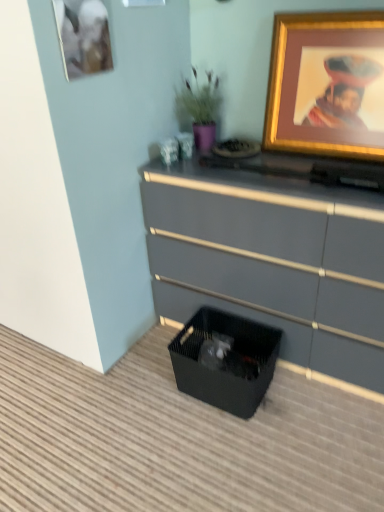
Question: Considering the relative positions of purple matte vase at upper center and matte gold picture frame at upper left, the first picture frame from the left, in the image provided, is purple matte vase at upper center in front of matte gold picture frame at upper left, the first picture frame from the left,?

Choices:
 (A) no
 (B) yes

Answer: (A)

Question: Considering the relative positions of purple matte vase at upper center and matte gold picture frame at upper left, the first picture frame from the left, in the image provided, is purple matte vase at upper center to the right of matte gold picture frame at upper left, the first picture frame from the left, from the viewer's perspective?

Choices:
 (A) yes
 (B) no

Answer: (A)

Question: Could you tell me if purple matte vase at upper center is facing matte gold picture frame at upper left, placed as the 2th picture frame when sorted from right to left?

Choices:
 (A) no
 (B) yes

Answer: (B)

Question: From the image's perspective, does purple matte vase at upper center appear higher than matte gold picture frame at upper left, the first picture frame from the left?

Choices:
 (A) no
 (B) yes

Answer: (A)

Question: Would you say purple matte vase at upper center contains matte gold picture frame at upper left, placed as the 2th picture frame when sorted from right to left?

Choices:
 (A) yes
 (B) no

Answer: (B)

Question: From the image's perspective, is matte gray dresser at center above or below black mesh storage box at lower center?

Choices:
 (A) below
 (B) above

Answer: (B)

Question: Is matte gray dresser at center in front of or behind black mesh storage box at lower center in the image?

Choices:
 (A) front
 (B) behind

Answer: (A)

Question: From their relative heights in the image, would you say matte gray dresser at center is taller or shorter than black mesh storage box at lower center?

Choices:
 (A) short
 (B) tall

Answer: (B)

Question: From a real-world perspective, is matte gray dresser at center positioned above or below black mesh storage box at lower center?

Choices:
 (A) below
 (B) above

Answer: (B)

Question: From the image's perspective, relative to black mesh storage box at lower center, is purple matte vase at upper center above or below?

Choices:
 (A) below
 (B) above

Answer: (B)

Question: Is purple matte vase at upper center bigger or smaller than black mesh storage box at lower center?

Choices:
 (A) small
 (B) big

Answer: (A)

Question: Considering the positions of purple matte vase at upper center and black mesh storage box at lower center in the image, is purple matte vase at upper center taller or shorter than black mesh storage box at lower center?

Choices:
 (A) short
 (B) tall

Answer: (B)

Question: Considering the positions of point (187, 118) and point (173, 368), is point (187, 118) closer or farther from the camera than point (173, 368)?

Choices:
 (A) farther
 (B) closer

Answer: (A)

Question: Is matte gray dresser at center in front of or behind gold-framed picture at upper right, the 2th picture frame from the left, in the image?

Choices:
 (A) behind
 (B) front

Answer: (B)

Question: From the image's perspective, relative to gold-framed picture at upper right, the 2th picture frame from the left, is matte gray dresser at center above or below?

Choices:
 (A) below
 (B) above

Answer: (A)